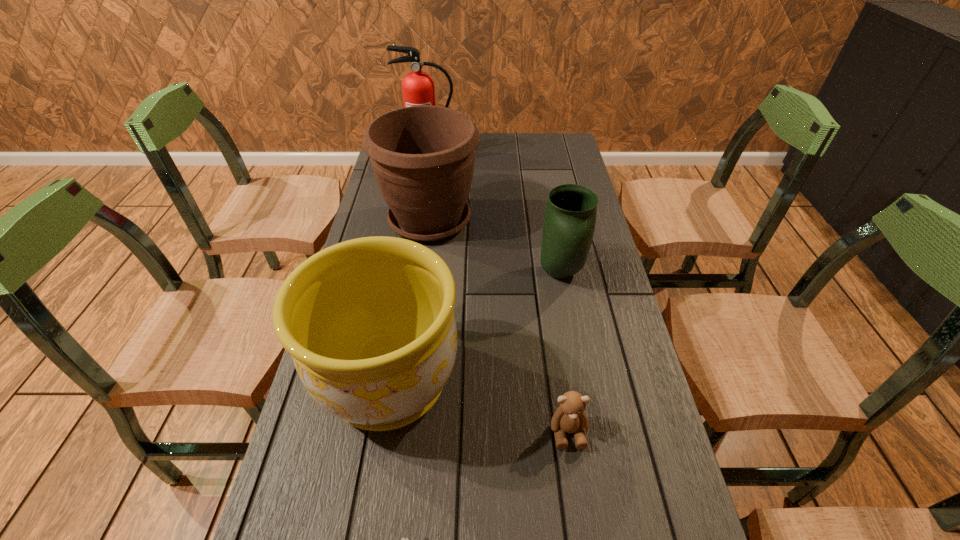
At what (x,y) coordinates should I click in order to perform the action: click on the tallest object. Please return your answer as a coordinate pair (x, y). Looking at the image, I should click on (418, 89).

At what (x,y) coordinates should I click in order to perform the action: click on the farthest object. Please return your answer as a coordinate pair (x, y). The width and height of the screenshot is (960, 540). Looking at the image, I should click on (418, 89).

The image size is (960, 540). In order to click on the farther flowerpot in this screenshot , I will do click(x=423, y=157).

What are the coordinates of `the nearer flowerpot` in the screenshot? It's located at (369, 322).

Locate an element on the screen. The height and width of the screenshot is (540, 960). the third shortest object is located at coordinates (570, 216).

This screenshot has width=960, height=540. I want to click on the fifth tallest object, so click(569, 417).

At what (x,y) coordinates should I click in order to perform the action: click on vacant space located 0.250m on the handle side of the fire extinguisher. Please return your answer as a coordinate pair (x, y). Looking at the image, I should click on (420, 207).

This screenshot has height=540, width=960. Find the location of `vacant space located on the front of the farther flowerpot`. vacant space located on the front of the farther flowerpot is located at coordinates (412, 357).

Image resolution: width=960 pixels, height=540 pixels. In order to click on free point located on the right of the nearer flowerpot in this screenshot , I will do `click(500, 382)`.

The height and width of the screenshot is (540, 960). In order to click on vacant space located 0.190m on the front of the third shortest object in this screenshot , I will do `click(575, 354)`.